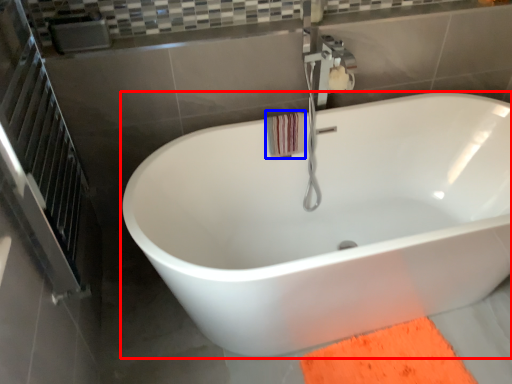
Question: Among these objects, which one is farthest to the camera, bathtub (highlighted by a red box) or beach towel (highlighted by a blue box)?

Choices:
 (A) bathtub
 (B) beach towel

Answer: (B)